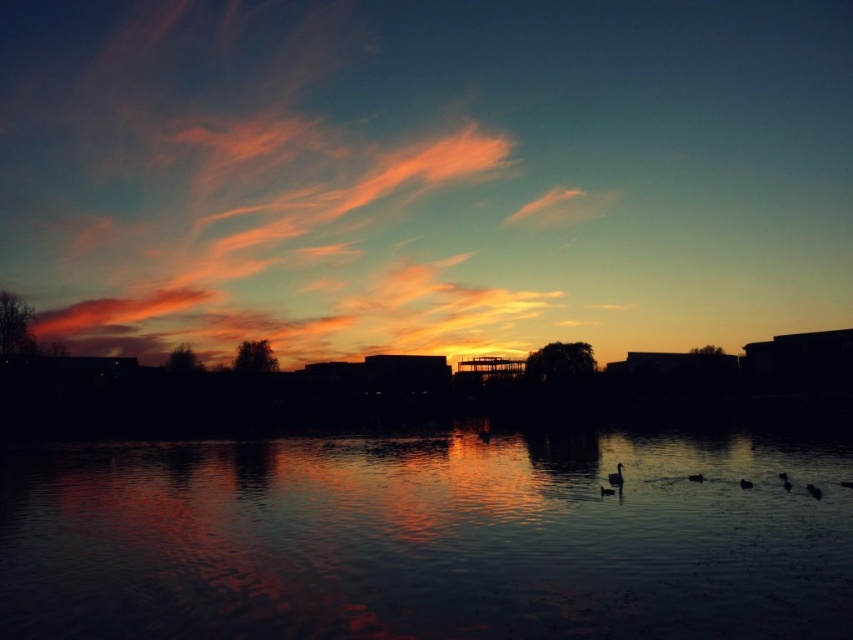
You are a photographer trying to capture the sunset scene. You want to position your camera so that the black matte duck at lower right is centered in the frame. What coordinates should you aim for?

You should aim for the coordinates point (695, 477) to center the black matte duck at lower right in the frame.

You are a photographer trying to capture the sunset reflection on the water. You have a camera with a 20cm wide lens. The glossy reflective water at center and the black matte duck at lower right are in your frame. Can the lens cover both objects without zooming out?

The glossy reflective water at center is larger than the black matte duck at lower right. Since the lens is 20cm wide, it depends on the actual sizes of the objects in the scene. However, since the water is larger, it might require adjusting the focus or cropping the image to include both without zooming out.